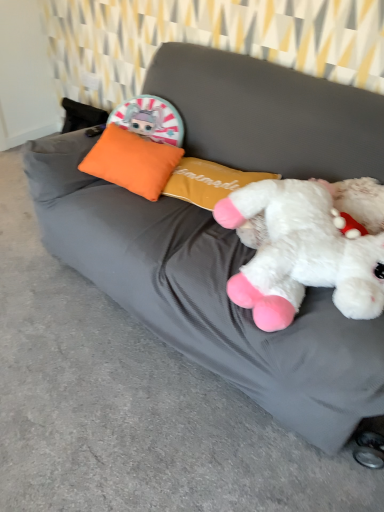
Question: Looking at the image, does orange fabric pillow at upper left seem bigger or smaller compared to white plush toy at right?

Choices:
 (A) big
 (B) small

Answer: (B)

Question: Considering the positions of orange fabric pillow at upper left and white plush toy at right in the image, is orange fabric pillow at upper left wider or thinner than white plush toy at right?

Choices:
 (A) wide
 (B) thin

Answer: (B)

Question: Is orange fabric pillow at upper left situated inside white plush toy at right or outside?

Choices:
 (A) outside
 (B) inside

Answer: (A)

Question: Would you say white plush toy at right is to the left or to the right of orange fabric pillow at upper left in the picture?

Choices:
 (A) right
 (B) left

Answer: (A)

Question: From the image's perspective, is white plush toy at right positioned above or below orange fabric pillow at upper left?

Choices:
 (A) above
 (B) below

Answer: (B)

Question: Based on their sizes in the image, would you say white plush toy at right is bigger or smaller than orange fabric pillow at upper left?

Choices:
 (A) big
 (B) small

Answer: (A)

Question: Is white plush toy at right inside the boundaries of orange fabric pillow at upper left, or outside?

Choices:
 (A) outside
 (B) inside

Answer: (A)